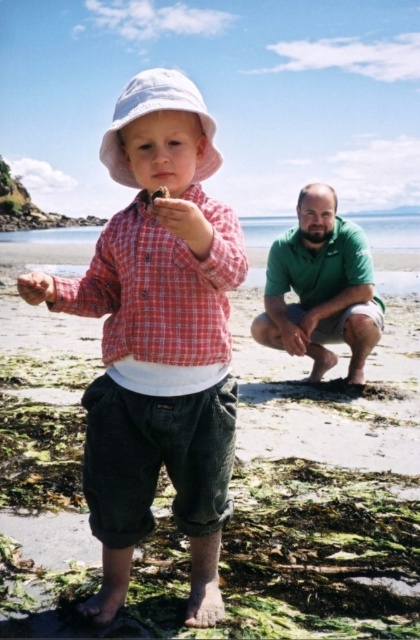
Between point (181, 301) and point (212, 292), which one is positioned in front?

Point (212, 292)

Is point (157, 451) positioned in front of point (194, 202)?

No, it is not.

Is point (217, 360) positioned in front of point (107, 346)?

Yes, it is.

Identify the location of matte red plaid shirt at center. Image resolution: width=420 pixels, height=640 pixels. (157, 339).

Who is positioned more to the left, red checkered shirt at center or green cotton shirt at lower right?

red checkered shirt at center is more to the left.

Is point (130, 275) positioned after point (304, 253)?

No, (130, 275) is in front of (304, 253).

Locate an element on the screen. The height and width of the screenshot is (640, 420). red checkered shirt at center is located at coordinates (160, 298).

Does point (170, 333) come behind point (186, 81)?

Yes, it is.

Where is `matte red plaid shirt at center`? Image resolution: width=420 pixels, height=640 pixels. matte red plaid shirt at center is located at coordinates (157, 339).